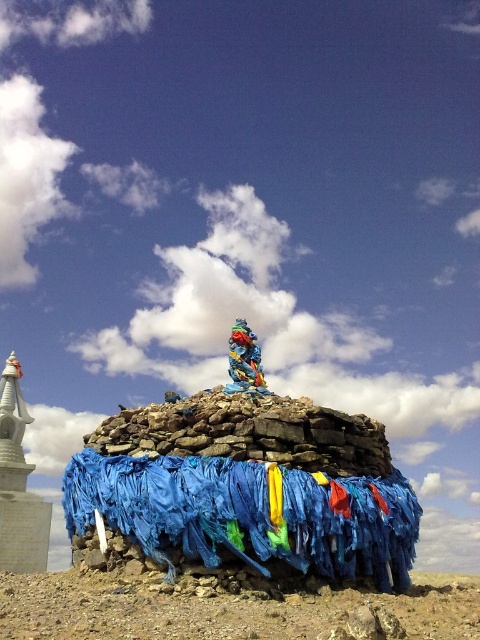
Question: Is blue fabric at center below white glossy stupa at left?

Choices:
 (A) yes
 (B) no

Answer: (B)

Question: Which object is positioned farthest from the white glossy stupa at left?

Choices:
 (A) blue fabric at center
 (B) multicolored painted statue at center

Answer: (A)

Question: Which point is closer to the camera?

Choices:
 (A) (256, 381)
 (B) (23, 428)
 (C) (190, 476)

Answer: (C)

Question: Can you confirm if white glossy stupa at left is positioned to the right of multicolored painted statue at center?

Choices:
 (A) yes
 (B) no

Answer: (B)

Question: Which is nearer to the white glossy stupa at left?

Choices:
 (A) blue fabric at center
 (B) multicolored painted statue at center

Answer: (B)

Question: Can you confirm if blue fabric at center is positioned to the left of white glossy stupa at left?

Choices:
 (A) yes
 (B) no

Answer: (B)